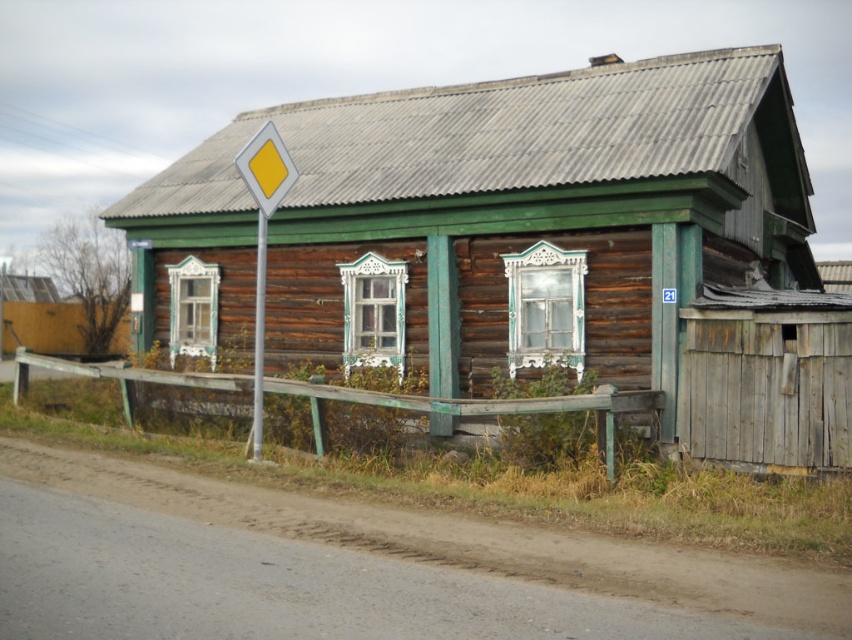
Is point (272, 314) in front of point (258, 371)?

No, (272, 314) is further to viewer.

Does wooden hut at center appear on the right side of yellow plastic diamond at left?

Indeed, wooden hut at center is positioned on the right side of yellow plastic diamond at left.

Who is more forward, (631, 348) or (242, 154)?

Point (242, 154) is more forward.

Identify the location of wooden hut at center. This screenshot has height=640, width=852. (527, 244).

Does point (682, 72) lie in front of point (257, 305)?

Yes, it is.

Can you confirm if wooden hut at center is wider than metallic pole at left?

Yes.

Describe the element at coordinates (527, 244) in the screenshot. Image resolution: width=852 pixels, height=640 pixels. I see `wooden hut at center` at that location.

Locate an element on the screen. The height and width of the screenshot is (640, 852). wooden hut at center is located at coordinates (527, 244).

Does green wooden fence at lower center have a greater width compared to yellow plastic diamond at upper left?

Yes.

Is green wooden fence at lower center taller than yellow plastic diamond at upper left?

Yes.

Which is in front, point (355, 397) or point (281, 147)?

Point (281, 147) is in front.

The image size is (852, 640). In order to click on green wooden fence at lower center in this screenshot , I will do `click(475, 404)`.